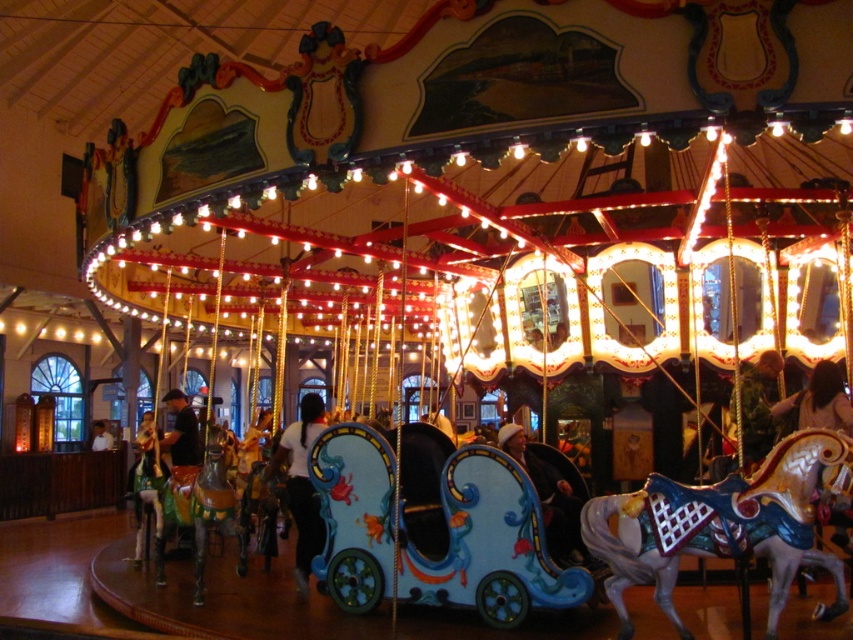
Is shiny metallic horse at center behind shiny gold horse at center?

No, shiny metallic horse at center is in front of shiny gold horse at center.

Find the location of `shiny metallic horse at center`. shiny metallic horse at center is located at coordinates (721, 525).